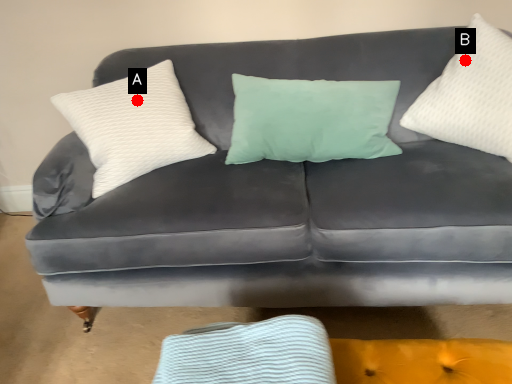
Question: Two points are circled on the image, labeled by A and B beside each circle. Which point is closer to the camera?

Choices:
 (A) A is closer
 (B) B is closer

Answer: (B)